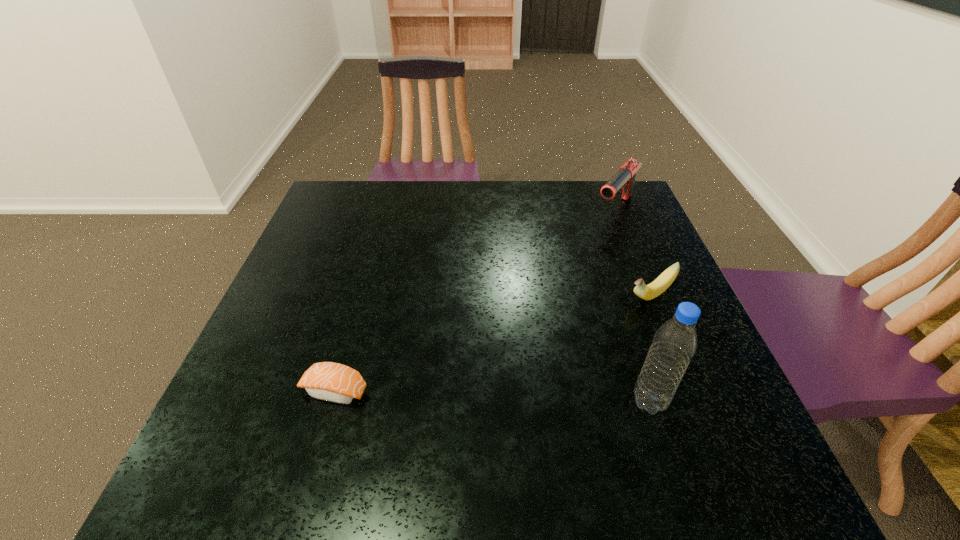
Locate an element on the screen. This screenshot has width=960, height=540. free point at the near left corner is located at coordinates (276, 401).

This screenshot has height=540, width=960. Find the location of `vacant space at the far right corner`. vacant space at the far right corner is located at coordinates (591, 204).

I want to click on empty space that is in between the leftmost object and the tallest object, so click(x=492, y=396).

This screenshot has width=960, height=540. Identify the location of blank region between the shortest object and the water bottle. (492, 396).

You are a GUI agent. You are given a task and a screenshot of the screen. Output one action in this format:
    pyautogui.click(x=<x>, y=<y>)
    Task: Click on the free space between the second shortest object and the shortest object
    
    Given the screenshot: What is the action you would take?
    pyautogui.click(x=492, y=343)

Image resolution: width=960 pixels, height=540 pixels. In order to click on vacant space that is in between the sushi and the second tallest object in this screenshot , I will do `click(474, 300)`.

The width and height of the screenshot is (960, 540). I want to click on free space between the sushi and the third nearest object, so click(492, 343).

I want to click on free area in between the shortest object and the tallest object, so click(492, 396).

The image size is (960, 540). In order to click on unoccupied area between the leftmost object and the banana in this screenshot , I will do `click(492, 343)`.

Find the location of `unoccupied area between the water bottle and the farthest object`. unoccupied area between the water bottle and the farthest object is located at coordinates (632, 306).